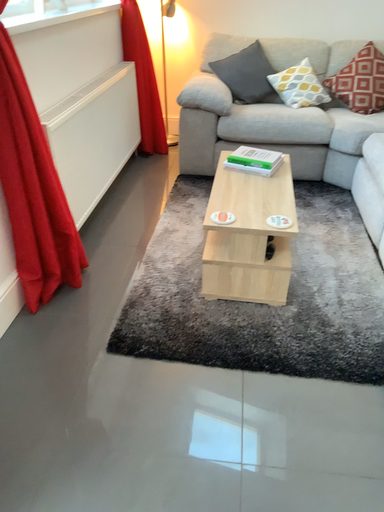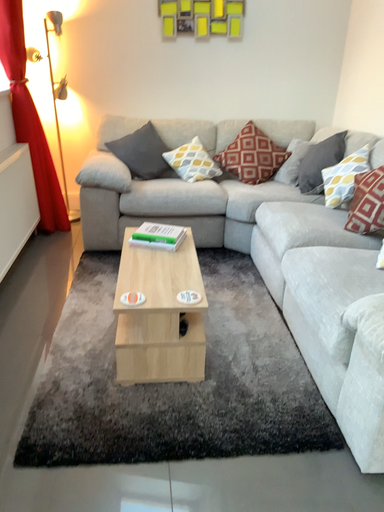
Question: How did the camera likely rotate when shooting the video?

Choices:
 (A) rotated downward
 (B) rotated upward

Answer: (B)